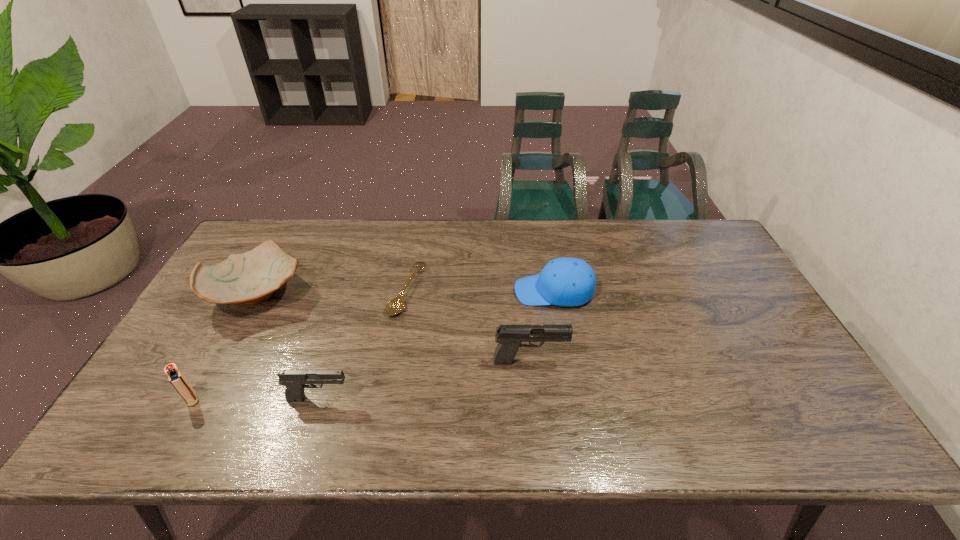
Find the location of a particular element. This screenshot has height=540, width=960. free location located 0.400m aim along the barrel of the right pistol is located at coordinates (720, 360).

Locate an element on the screen. This screenshot has width=960, height=540. vacant point located on the right of the pottery is located at coordinates (323, 293).

The image size is (960, 540). Find the location of `free spot located 0.230m on the right of the shortest object`. free spot located 0.230m on the right of the shortest object is located at coordinates (499, 291).

The width and height of the screenshot is (960, 540). Find the location of `free region located on the front-facing side of the cap`. free region located on the front-facing side of the cap is located at coordinates (399, 291).

Locate an element on the screen. This screenshot has width=960, height=540. blank area located on the front-facing side of the cap is located at coordinates (468, 291).

This screenshot has width=960, height=540. What are the coordinates of `vacant space situated 0.230m on the front-facing side of the cap` in the screenshot? It's located at (439, 291).

You are a GUI agent. You are given a task and a screenshot of the screen. Output one action in this format:
    pyautogui.click(x=<x>, y=<y>)
    Task: Click on the free space located 0.090m on the left of the igniter
    Image resolution: width=960 pixels, height=540 pixels.
    Given the screenshot: What is the action you would take?
    pyautogui.click(x=147, y=400)

Where is `pistol that is at the near edge`? The width and height of the screenshot is (960, 540). pistol that is at the near edge is located at coordinates (295, 381).

Identify the location of igniter at the near edge. The height and width of the screenshot is (540, 960). (176, 378).

Find the location of a particular element. The width and height of the screenshot is (960, 540). pottery at the left edge is located at coordinates (252, 277).